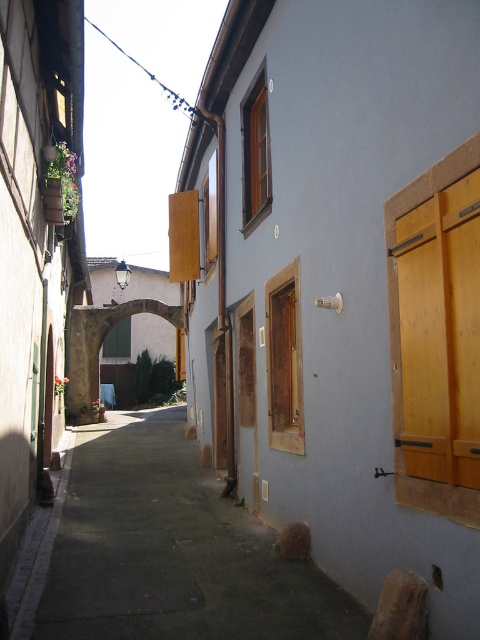
The width and height of the screenshot is (480, 640). What do you see at coordinates (172, 550) in the screenshot?
I see `smooth concrete sidewalk at center` at bounding box center [172, 550].

Consider the image. Can you confirm if smooth concrete sidewalk at center is taller than yellow wood shutters at right?

No.

Is point (208, 492) less distant than point (400, 499)?

No, (208, 492) is further to viewer.

I want to click on smooth concrete sidewalk at center, so click(172, 550).